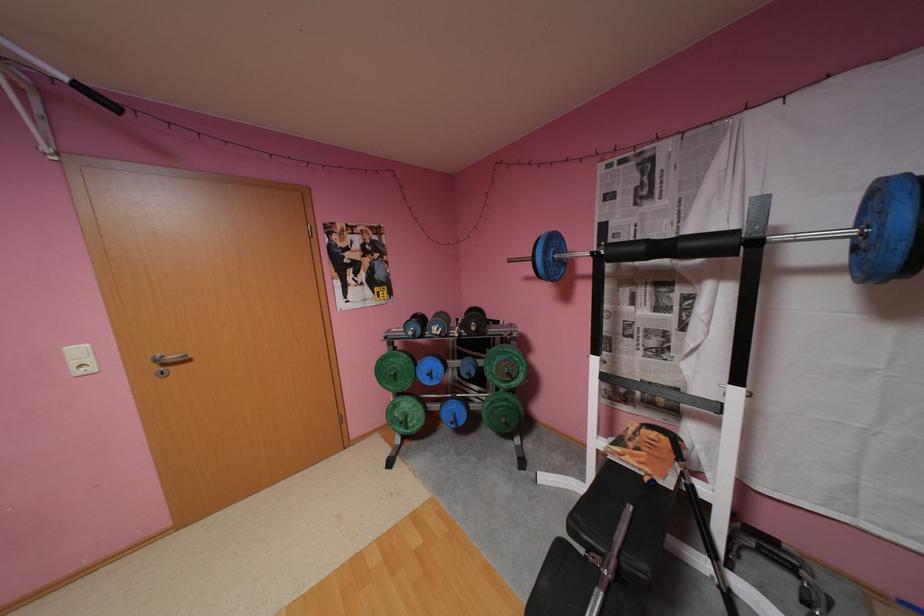
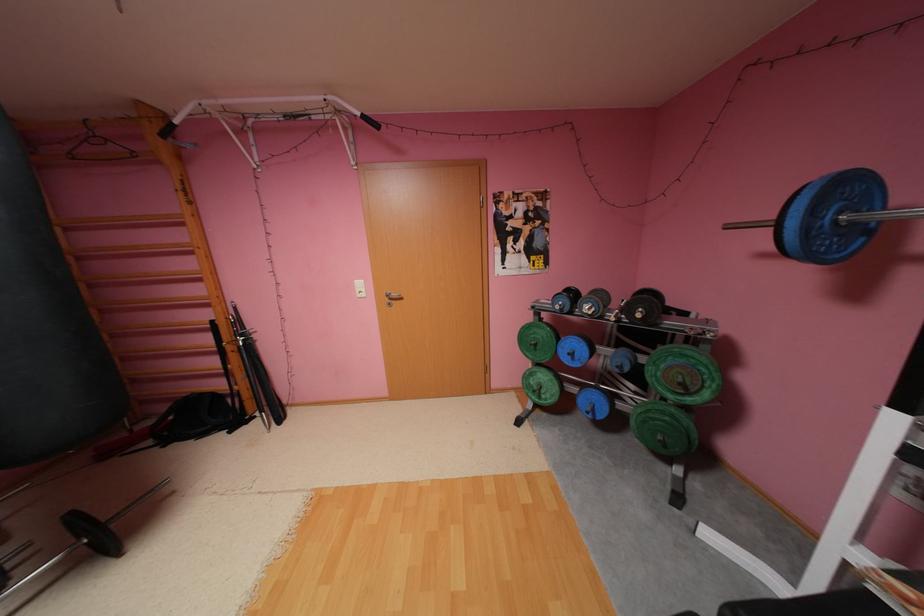
Find the pixel in the second image that matches (x=439, y=374) in the first image.

(580, 354)